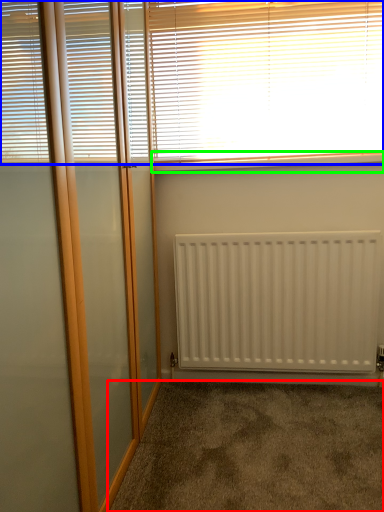
Question: Estimate the real-world distances between objects in this image. Which object is farther from corridor (highlighted by a red box), window blind (highlighted by a blue box) or window sill (highlighted by a green box)?

Choices:
 (A) window blind
 (B) window sill

Answer: (A)